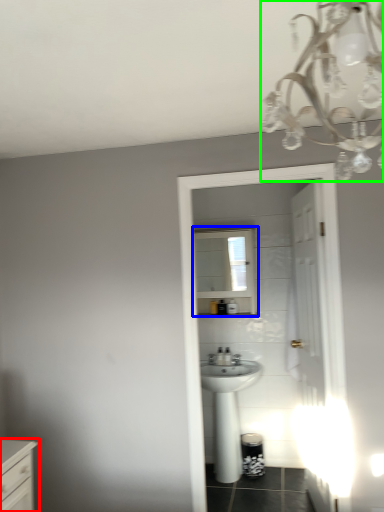
Question: Estimate the real-world distances between objects in this image. Which object is closer to chest of drawers (highlighted by a red box), medicine cabinet (highlighted by a blue box) or light fixture (highlighted by a green box)?

Choices:
 (A) medicine cabinet
 (B) light fixture

Answer: (B)